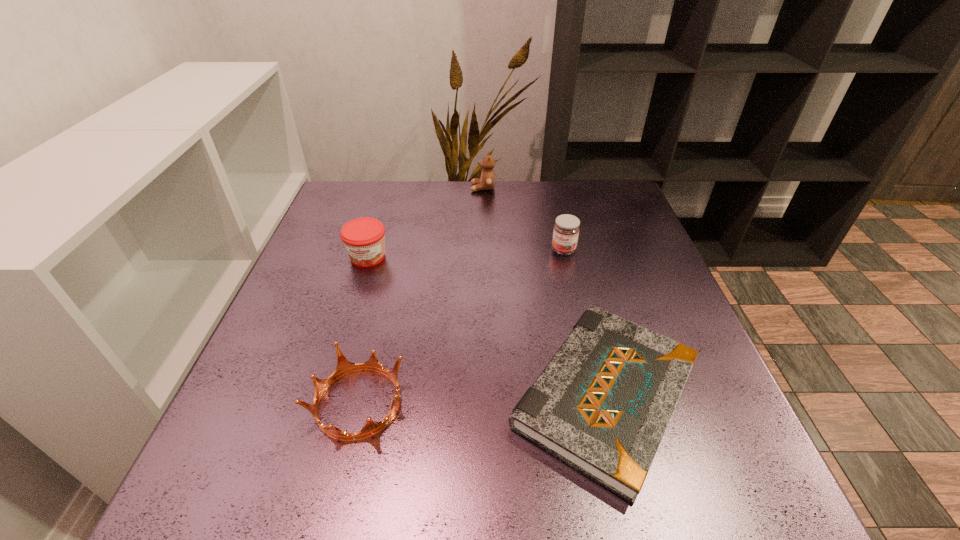
Image resolution: width=960 pixels, height=540 pixels. Identify the location of the farthest object. (487, 181).

At what (x,y) coordinates should I click in order to perform the action: click on teddy bear. Please return your answer as a coordinate pair (x, y). The image size is (960, 540). Looking at the image, I should click on (487, 181).

This screenshot has width=960, height=540. I want to click on the right jam, so click(566, 230).

Locate an element on the screen. Image resolution: width=960 pixels, height=540 pixels. the left jam is located at coordinates (364, 238).

The height and width of the screenshot is (540, 960). In order to click on the second shortest object in this screenshot , I will do `click(344, 367)`.

Where is `the shortest object`? This screenshot has height=540, width=960. the shortest object is located at coordinates (602, 404).

Where is `free region located 0.330m on the front-facing side of the third object from right to left`? This screenshot has height=540, width=960. free region located 0.330m on the front-facing side of the third object from right to left is located at coordinates (361, 188).

Where is `free space located on the front-facing side of the third object from right to left`? The image size is (960, 540). free space located on the front-facing side of the third object from right to left is located at coordinates (420, 188).

Where is `vacant space situated on the front-facing side of the third object from right to left`? vacant space situated on the front-facing side of the third object from right to left is located at coordinates (344, 188).

Identify the location of vacant area located on the front of the right jam. Image resolution: width=960 pixels, height=540 pixels. (573, 292).